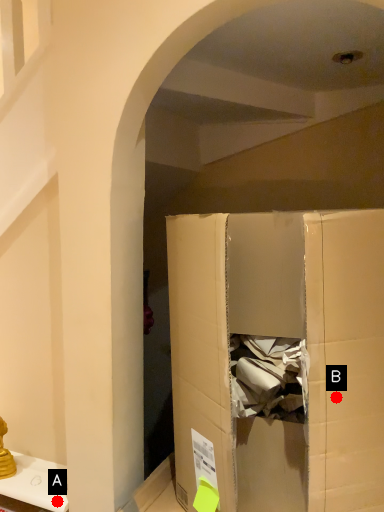
Question: Two points are circled on the image, labeled by A and B beside each circle. Which point is farther to the camera?

Choices:
 (A) A is further
 (B) B is further

Answer: (A)